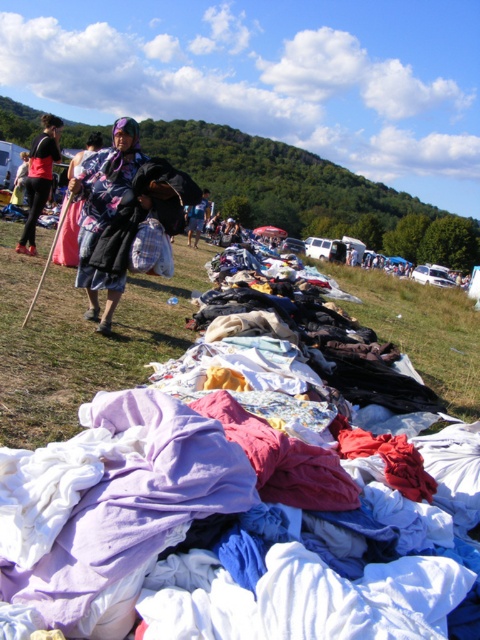
Which is more to the right, green grass at center or light blue fabric at center?

green grass at center is more to the right.

Looking at this image, is green grass at center thinner than light blue fabric at center?

No, green grass at center is not thinner than light blue fabric at center.

The width and height of the screenshot is (480, 640). In order to click on green grass at center in this screenshot , I will do `click(420, 328)`.

Locate an element on the screen. This screenshot has height=640, width=480. green grass at center is located at coordinates 420,328.

Which is below, green grass at center or wrinkled fabric at center?

wrinkled fabric at center is below.

Who is more distant from viewer, (440, 371) or (57, 321)?

Positioned behind is point (440, 371).

Identify the location of green grass at center. (420, 328).

Who is more distant from viewer, [433,304] or [21,173]?

Point [21,173]

Looking at this image, who is positioned more to the right, green grass at center or purple cotton blanket at center?

green grass at center is more to the right.

This screenshot has height=640, width=480. What do you see at coordinates (420, 328) in the screenshot?
I see `green grass at center` at bounding box center [420, 328].

Locate an element on the screen. The image size is (480, 640). green grass at center is located at coordinates (420, 328).